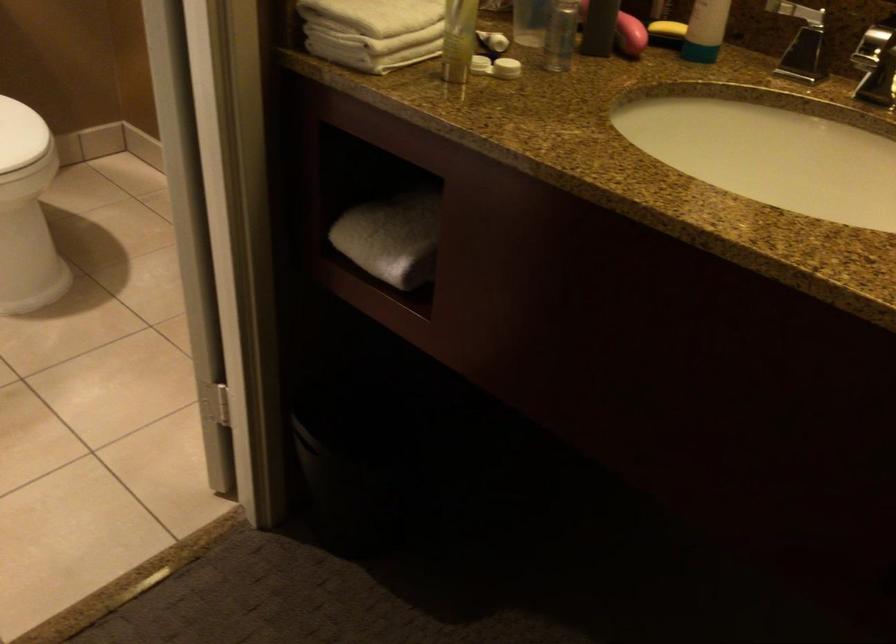
Find where to lift the metal faucet handle. Please return your answer as a coordinate pair (x, y).

(876, 64)